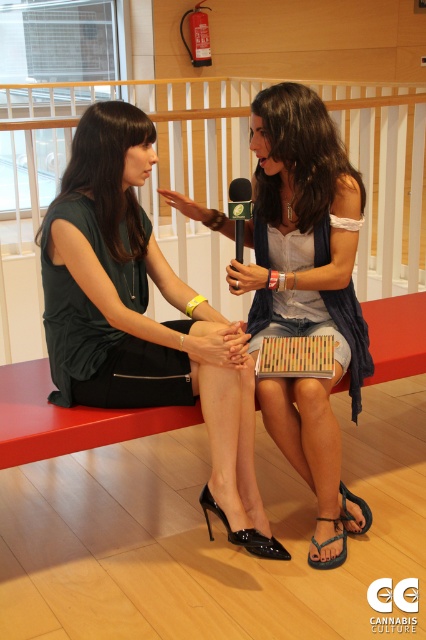
Between point (239, 456) and point (339, 557), which one is positioned behind?

Positioned behind is point (339, 557).

What do you see at coordinates (143, 316) in the screenshot?
I see `matte black dress at left` at bounding box center [143, 316].

In order to click on matte black dress at left in this screenshot , I will do `click(143, 316)`.

Which of these two, matte black dress at left or blue fabric sandal at lower right, stands taller?

matte black dress at left is taller.

Consider the image. Who is more forward, (57, 392) or (370, 520)?

Point (57, 392) is in front.

What are the coordinates of `matte black dress at left` in the screenshot? It's located at (143, 316).

Which is in front, point (313, 132) or point (224, 525)?

Positioned in front is point (313, 132).

Where is `matte black dress at center`? This screenshot has width=426, height=640. matte black dress at center is located at coordinates (304, 275).